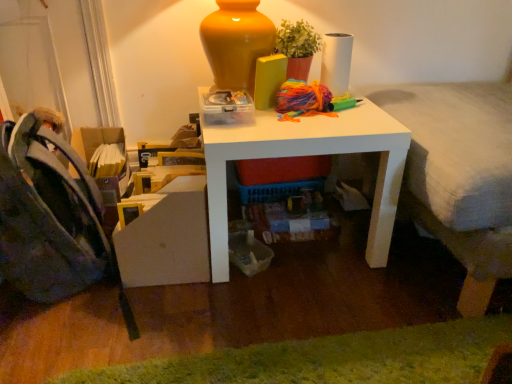
Question: Based on their positions, is dark blue fabric folding chair at left located to the left or right of white matte table at center?

Choices:
 (A) right
 (B) left

Answer: (B)

Question: In terms of size, does dark blue fabric folding chair at left appear bigger or smaller than white matte table at center?

Choices:
 (A) big
 (B) small

Answer: (B)

Question: Estimate the real-world distances between objects in this image. Which object is farther from the white matte table at center?

Choices:
 (A) green fuzzy rug at lower center
 (B) textured gray bed at right
 (C) dark blue fabric folding chair at left
 (D) matte terracotta pot at upper center

Answer: (C)

Question: Which object is the closest to the green fuzzy rug at lower center?

Choices:
 (A) matte terracotta pot at upper center
 (B) white matte table at center
 (C) textured gray bed at right
 (D) dark blue fabric folding chair at left

Answer: (B)